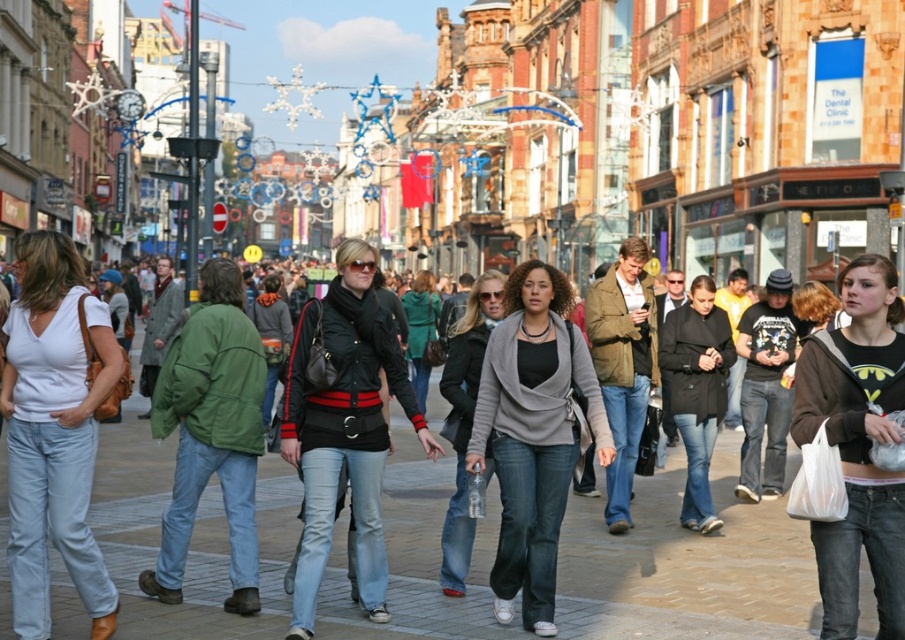
Is point (586, 529) farther from camera compared to point (405, 310)?

No, it is in front of (405, 310).

Is denim jeans at center to the left of green leather jacket at center from the viewer's perspective?

Indeed, denim jeans at center is positioned on the left side of green leather jacket at center.

At what (x,y) coordinates should I click in order to perform the action: click on denim jeans at center. Please return your answer as a coordinate pair (x, y). The height and width of the screenshot is (640, 905). Looking at the image, I should click on (686, 566).

Does point (484, 340) come in front of point (417, 372)?

Yes, it is.

Which is behind, point (464, 554) or point (407, 316)?

Point (407, 316)

Describe the element at coordinates (464, 419) in the screenshot. I see `matte black jacket at center` at that location.

Identify the location of matte black jacket at center. This screenshot has width=905, height=640. (464, 419).

From the picture: Can you confirm if black leather jacket at center is wider than green leather jacket at center?

Yes.

Who is more distant from viewer, (332, 438) or (424, 406)?

Positioned behind is point (424, 406).

Between point (373, 454) and point (415, 394), which one is positioned behind?

The point (415, 394) is behind.

Where is `black leather jacket at center`? The image size is (905, 640). black leather jacket at center is located at coordinates coord(344,428).